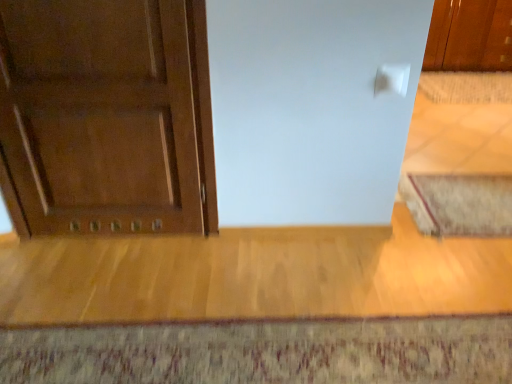
Question: Is beige textured rug at lower right, which is the second doormat in front-to-back order, taller than textured wool doormat at lower center, the third doormat in the top-to-bottom sequence?

Choices:
 (A) no
 (B) yes

Answer: (B)

Question: From the image's perspective, does beige textured rug at lower right, which is the second doormat in front-to-back order, appear lower than textured wool doormat at lower center, which ranks as the third doormat in right-to-left order?

Choices:
 (A) yes
 (B) no

Answer: (B)

Question: From the image's perspective, would you say beige textured rug at lower right, the 2th doormat from the left, is positioned over textured wool doormat at lower center, the 1th doormat positioned from the left?

Choices:
 (A) yes
 (B) no

Answer: (A)

Question: Is beige textured rug at lower right, placed as the 2th doormat when sorted from top to bottom, facing towards textured wool doormat at lower center, positioned as the 1th doormat in front-to-back order?

Choices:
 (A) no
 (B) yes

Answer: (A)

Question: Is textured wool doormat at lower center, arranged as the 1th doormat when ordered from the bottom, located within beige textured rug at lower right, acting as the 2th doormat starting from the right?

Choices:
 (A) yes
 (B) no

Answer: (B)

Question: Considering the relative positions of beige textured rug at lower right, which is the second doormat in front-to-back order, and textured wool doormat at lower center, the third doormat in the top-to-bottom sequence, in the image provided, is beige textured rug at lower right, which is the second doormat in front-to-back order, to the right of textured wool doormat at lower center, the third doormat in the top-to-bottom sequence, from the viewer's perspective?

Choices:
 (A) no
 (B) yes

Answer: (B)

Question: From a real-world perspective, is textured wool doormat at lower center, which ranks as the third doormat in right-to-left order, on glossy wood cabinet at upper right?

Choices:
 (A) yes
 (B) no

Answer: (B)

Question: Is textured wool doormat at lower center, arranged as the 1th doormat when ordered from the bottom, outside glossy wood cabinet at upper right?

Choices:
 (A) yes
 (B) no

Answer: (A)

Question: Does textured wool doormat at lower center, the third doormat in the top-to-bottom sequence, appear on the left side of glossy wood cabinet at upper right?

Choices:
 (A) no
 (B) yes

Answer: (B)

Question: Is textured wool doormat at lower center, the 1th doormat positioned from the left, aimed at glossy wood cabinet at upper right?

Choices:
 (A) yes
 (B) no

Answer: (B)

Question: Considering the relative sizes of textured wool doormat at lower center, the 1th doormat positioned from the left, and glossy wood cabinet at upper right in the image provided, is textured wool doormat at lower center, the 1th doormat positioned from the left, shorter than glossy wood cabinet at upper right?

Choices:
 (A) yes
 (B) no

Answer: (A)

Question: Is textured wool doormat at lower center, which ranks as the third doormat in right-to-left order, thinner than glossy wood cabinet at upper right?

Choices:
 (A) yes
 (B) no

Answer: (B)

Question: From the image's perspective, is matte wood door at left beneath beige textured rug at lower right, the 2th doormat from the left?

Choices:
 (A) yes
 (B) no

Answer: (B)